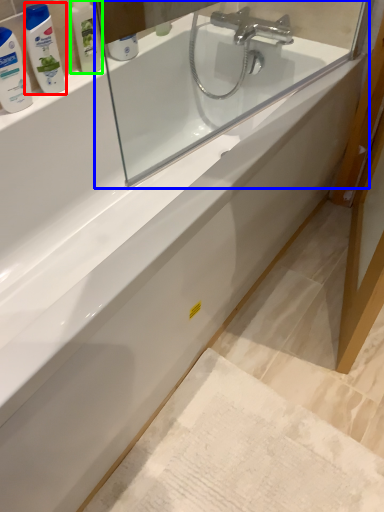
Question: Which object is the farthest from mouthwash (highlighted by a red box)? Choose among these: mirror (highlighted by a blue box) or toiletry (highlighted by a green box).

Choices:
 (A) mirror
 (B) toiletry

Answer: (A)